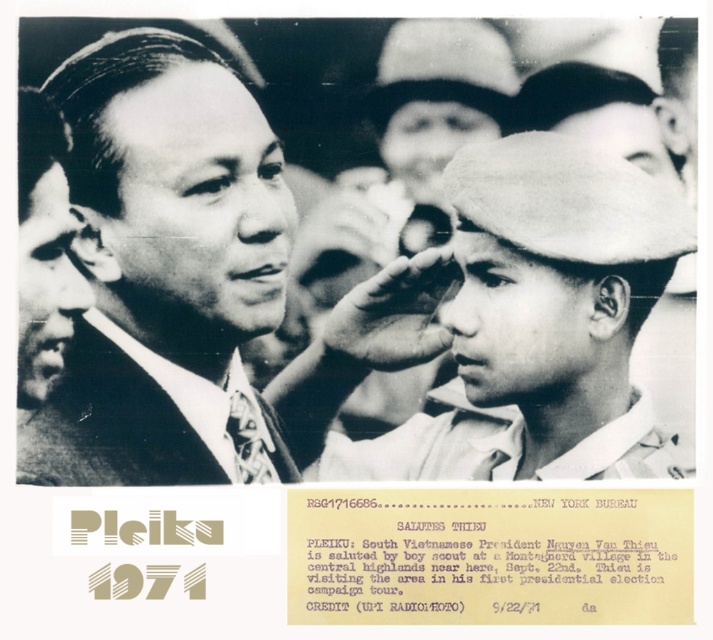
You are a photographer who needs to adjust the lighting in the scene to ensure both the white felt hat at center and the patterned fabric tie at left are clearly visible. Based on their positions, which object is closer to the light source?

The white felt hat at center is above the patterned fabric tie at left, so it is closer to the light source.

You are analyzing the positions of objects in the image. The smooth black suit at center is at coordinates 0.422, 0.234. If you were to draw a vertical line through this point, would it divide the image into two equal halves horizontally or vertically?

Drawing a vertical line through the point (165, 269) would divide the image vertically, but since the coordinates are given as x,y, the vertical line at x 0.422 would not necessarily create equal halves unless the image is square and the x coordinate is exactly 0.5. Since 0.422 is less than 0.5, the right side would be slightly larger.